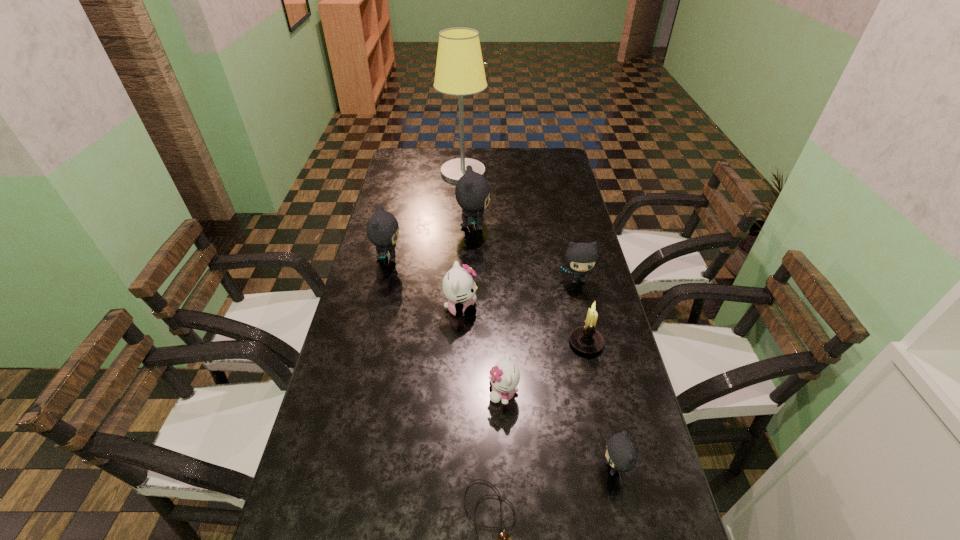
At what (x,y) coordinates should I click in order to perform the action: click on free space at the far edge of the desktop. Please return your answer as a coordinate pair (x, y). Looking at the image, I should click on (438, 169).

In the image, there is a desktop. Identify the location of vacant space at the left edge. The height and width of the screenshot is (540, 960). (324, 513).

Find the location of a particular element. This screenshot has width=960, height=540. vacant position at the right edge of the desktop is located at coordinates (605, 415).

Where is `free space at the far left corner of the desktop`? The width and height of the screenshot is (960, 540). free space at the far left corner of the desktop is located at coordinates (411, 166).

In the image, there is a desktop. Identify the location of free region at the far right corner. (547, 170).

At what (x,y) coordinates should I click in order to perform the action: click on vacant area between the farthest object and the leftmost kitten. Please return your answer as a coordinate pair (x, y). This screenshot has width=960, height=540. Looking at the image, I should click on (425, 215).

Find the location of `free spot between the second smallest gray kitten and the nearest gray kitten`. free spot between the second smallest gray kitten and the nearest gray kitten is located at coordinates (596, 374).

This screenshot has height=540, width=960. What are the coordinates of `free space that is in between the second tallest object and the nearest kitten` in the screenshot? It's located at (543, 347).

Where is `free space between the third biggest gray kitten and the smallest gray kitten`? free space between the third biggest gray kitten and the smallest gray kitten is located at coordinates (596, 374).

Find the location of a particular element. This screenshot has width=960, height=540. vacant space that's between the tallest object and the nearer white kitten is located at coordinates (483, 282).